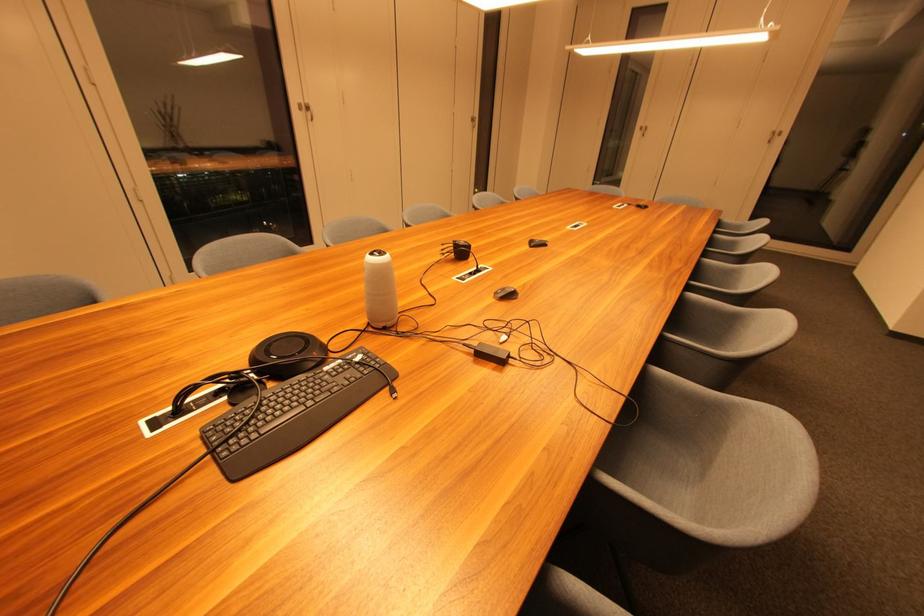
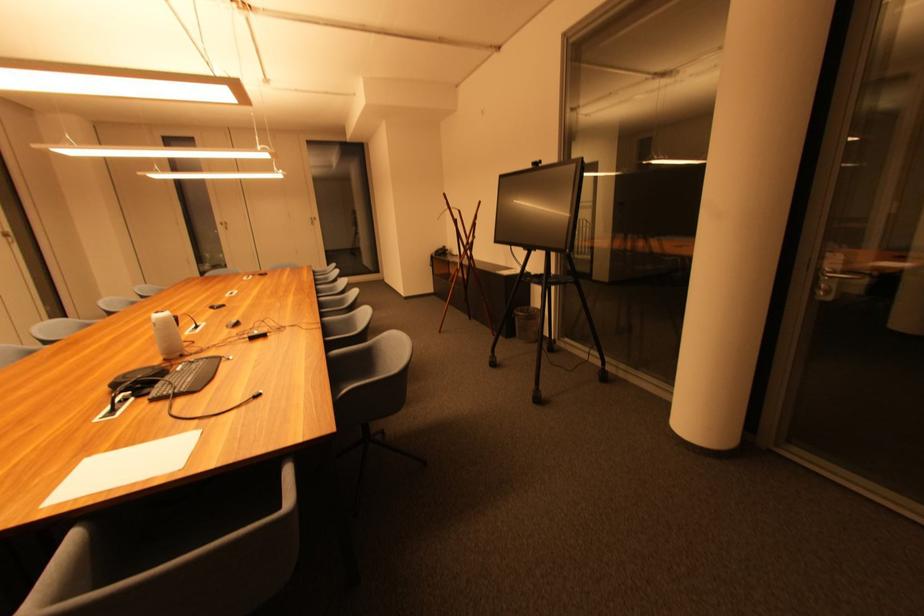
Locate, in the second image, the point that corresponds to (x=332, y=371) in the first image.

(184, 371)